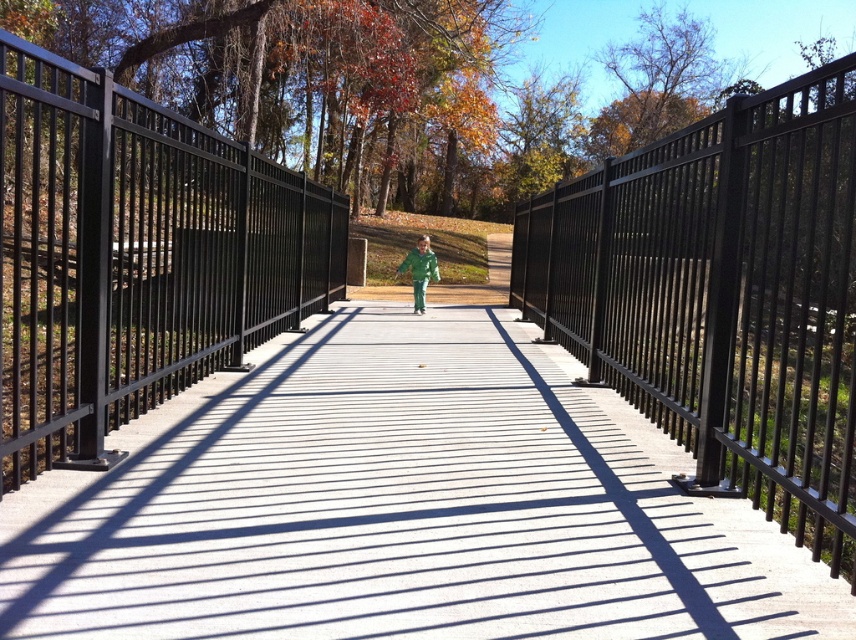
Is black metal fence at left below green matte jacket at center?

No, black metal fence at left is not below green matte jacket at center.

The image size is (856, 640). Describe the element at coordinates (134, 257) in the screenshot. I see `black metal fence at left` at that location.

Image resolution: width=856 pixels, height=640 pixels. In order to click on black metal fence at left in this screenshot , I will do `click(134, 257)`.

I want to click on black metal fence at left, so click(134, 257).

Can you confirm if smooth concrete path at center is thinner than black metal fence at center?

Yes, smooth concrete path at center is thinner than black metal fence at center.

Does smooth concrete path at center have a greater width compared to black metal fence at center?

Incorrect, smooth concrete path at center's width does not surpass black metal fence at center's.

Which is in front, point (382, 595) or point (693, 452)?

Point (382, 595) is in front.

Locate an element on the screen. This screenshot has height=640, width=856. smooth concrete path at center is located at coordinates tap(400, 506).

Can you confirm if smooth concrete path at center is thinner than green matte jacket at center?

No, smooth concrete path at center is not thinner than green matte jacket at center.

Does smooth concrete path at center appear on the right side of green matte jacket at center?

Indeed, smooth concrete path at center is positioned on the right side of green matte jacket at center.

The height and width of the screenshot is (640, 856). What do you see at coordinates (400, 506) in the screenshot?
I see `smooth concrete path at center` at bounding box center [400, 506].

This screenshot has height=640, width=856. Find the location of `smooth concrete path at center`. smooth concrete path at center is located at coordinates (400, 506).